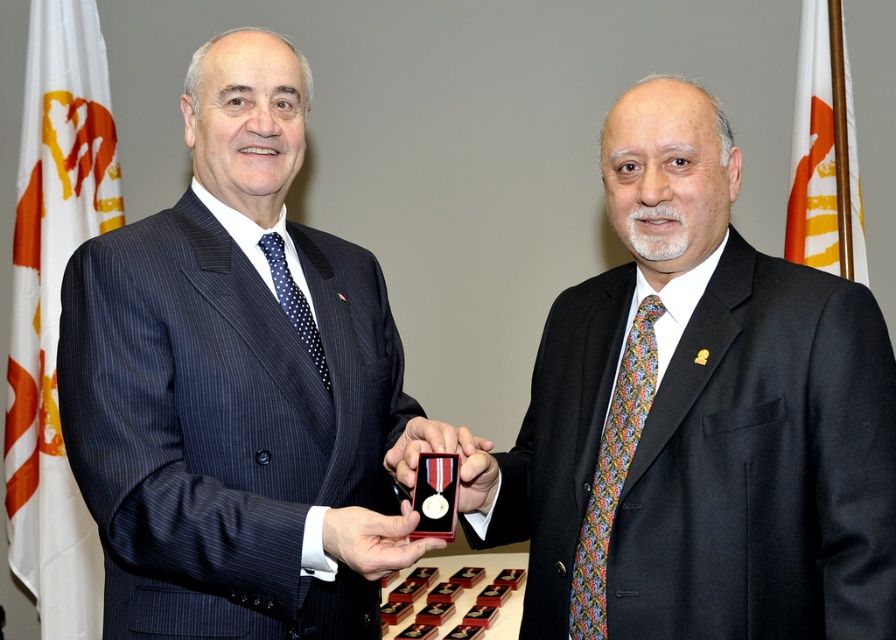
Question: Which of these objects is positioned farthest from the multicolored woven tie at right?

Choices:
 (A) matte black suit at center
 (B) metallic medal at center

Answer: (A)

Question: Is white fabric flag at upper right thinner than metallic gold medal at center?

Choices:
 (A) no
 (B) yes

Answer: (A)

Question: Which of the following is the closest to the observer?

Choices:
 (A) metallic gold medal at center
 (B) matte black suit at center
 (C) shiny gold medal at center
 (D) white fabric flag at upper right

Answer: (C)

Question: Which point is farther to the camera?

Choices:
 (A) metallic medal at center
 (B) white fabric flag at upper right
 (C) shiny gold medal at center
 (D) multicolored woven tie at right

Answer: (B)

Question: Does white fabric flag at left appear on the right side of metallic gold medal at center?

Choices:
 (A) no
 (B) yes

Answer: (A)

Question: In this image, where is metallic medal at center located relative to blue dotted tie at left?

Choices:
 (A) below
 (B) above

Answer: (A)